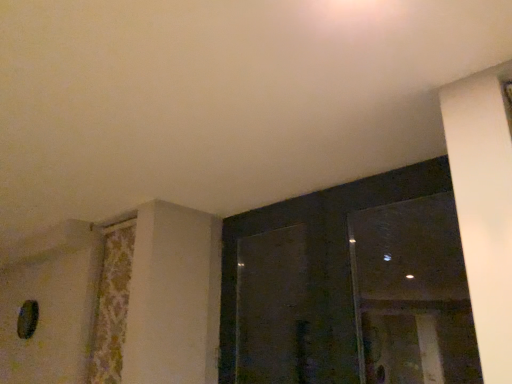
Question: In the image, is transparent glass screen door at center on the left side or the right side of transparent glass window at upper right, acting as the first window starting from the left?

Choices:
 (A) left
 (B) right

Answer: (A)

Question: From the image's perspective, is transparent glass screen door at center above or below transparent glass window at upper right, acting as the first window starting from the left?

Choices:
 (A) above
 (B) below

Answer: (B)

Question: Estimate the real-world distances between objects in this image. Which object is closer to the transparent glass screen door at center?

Choices:
 (A) transparent glass window at upper right, the 1th window viewed from the right
 (B) transparent glass window at upper right, acting as the first window starting from the left
 (C) floral fabric curtain at left

Answer: (B)

Question: Considering the real-world distances, which object is closest to the floral fabric curtain at left?

Choices:
 (A) transparent glass window at upper right, acting as the first window starting from the left
 (B) transparent glass screen door at center
 (C) transparent glass window at upper right, acting as the second window starting from the left

Answer: (B)